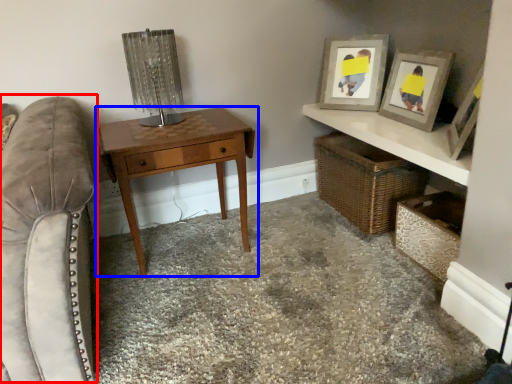
Question: Which of the following is the farthest to the observer, swivel chair (highlighted by a red box) or table (highlighted by a blue box)?

Choices:
 (A) swivel chair
 (B) table

Answer: (B)